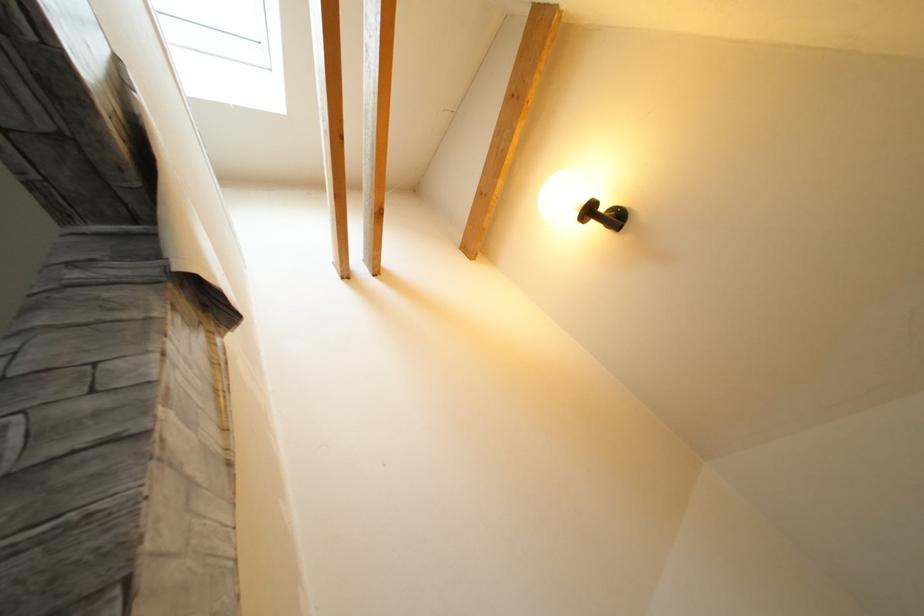
You are a GUI agent. You are given a task and a screenshot of the screen. Output one action in this format:
    pyautogui.click(x=<x>, y=<y>)
    Task: Click on the peeling wallpaper edge
    
    Given the screenshot: What is the action you would take?
    pyautogui.click(x=190, y=342)